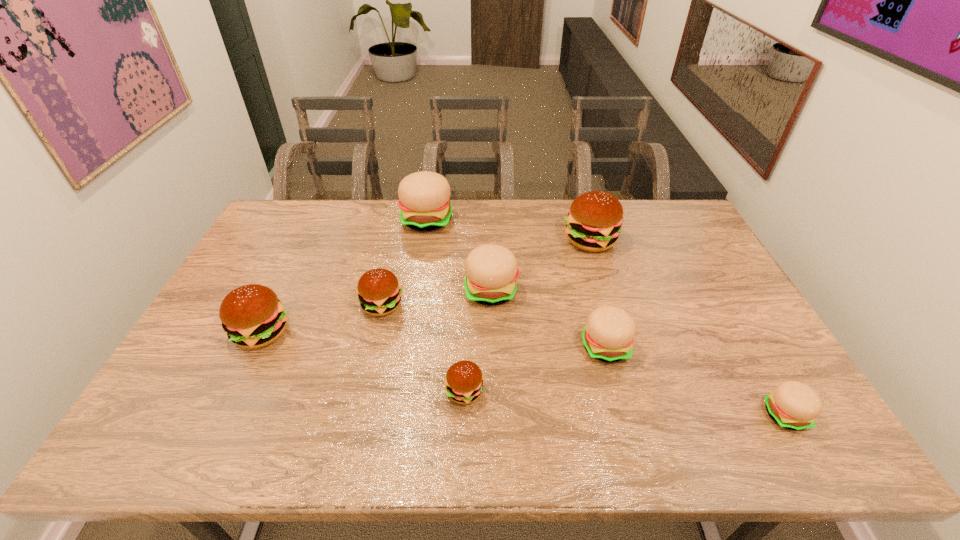
Locate an element on the screen. free space located 0.280m on the back of the third biggest beige hamburger is located at coordinates (583, 264).

You are a GUI agent. You are given a task and a screenshot of the screen. Output one action in this format:
    pyautogui.click(x=<x>, y=<y>)
    Task: Click on the vacant point located 0.250m on the back of the second brown hamburger from right to left
    The width and height of the screenshot is (960, 540).
    Given the screenshot: What is the action you would take?
    pyautogui.click(x=468, y=304)

Image resolution: width=960 pixels, height=540 pixels. Identify the location of vacant space located on the left of the rightmost hamburger. (713, 415).

The image size is (960, 540). Find the location of `object at the near edge`. object at the near edge is located at coordinates (793, 405).

This screenshot has width=960, height=540. Identify the location of object at the left edge. (252, 315).

Where is `object located at the right edge`? Image resolution: width=960 pixels, height=540 pixels. object located at the right edge is located at coordinates (793, 405).

The width and height of the screenshot is (960, 540). I want to click on object that is at the near right corner, so click(793, 405).

Where is `vacant space at the far edge`? vacant space at the far edge is located at coordinates (460, 221).

I want to click on free space at the near edge, so click(492, 451).

Find the location of a particular element. This screenshot has width=960, height=540. vacant space at the left edge of the desktop is located at coordinates (217, 368).